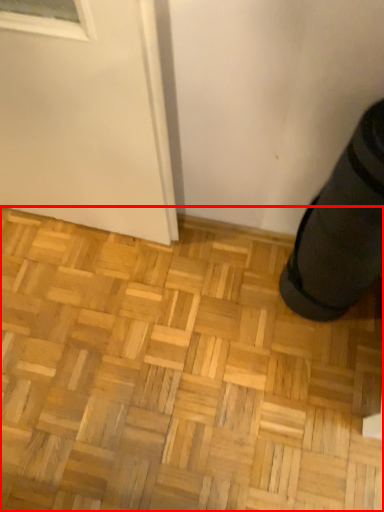
Question: From the image, what is the correct spatial relationship of hardwood (annotated by the red box) in relation to shoe?

Choices:
 (A) right
 (B) left

Answer: (B)